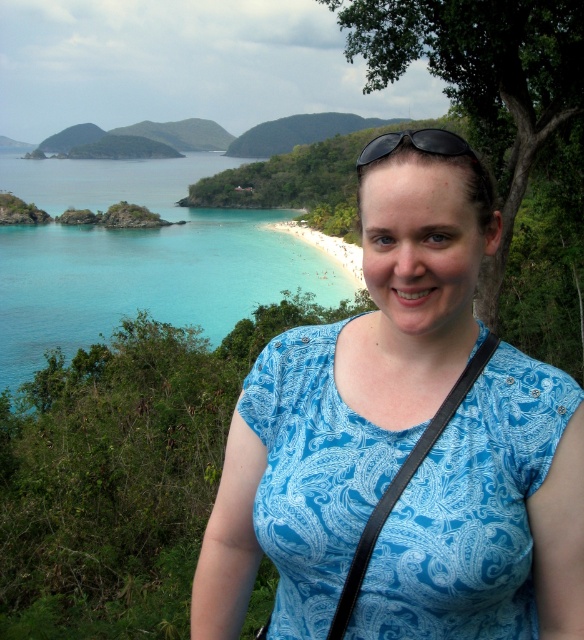
Who is more distant from viewer, (2, 230) or (418, 144)?

The point (2, 230) is more distant.

Who is positioned more to the right, turquoise water at upper left or black plastic sunglasses at upper center?

From the viewer's perspective, black plastic sunglasses at upper center appears more on the right side.

Who is more distant from viewer, (15, 348) or (422, 150)?

Positioned behind is point (15, 348).

Locate an element on the screen. turquoise water at upper left is located at coordinates (140, 257).

In the scene shown: Is blue paisley shirt at center shorter than turquoise water at upper left?

Indeed, blue paisley shirt at center has a lesser height compared to turquoise water at upper left.

The height and width of the screenshot is (640, 584). Describe the element at coordinates (402, 445) in the screenshot. I see `blue paisley shirt at center` at that location.

This screenshot has width=584, height=640. Identify the location of blue paisley shirt at center. (402, 445).

Is blue paisley shirt at center smaller than black plastic sunglasses at upper center?

Correct, blue paisley shirt at center occupies less space than black plastic sunglasses at upper center.

Can you confirm if blue paisley shirt at center is bigger than black plastic sunglasses at upper center?

No, blue paisley shirt at center is not bigger than black plastic sunglasses at upper center.

Who is more forward, (394, 179) or (391, 140)?

Positioned in front is point (394, 179).

You are a GUI agent. You are given a task and a screenshot of the screen. Output one action in this format:
    pyautogui.click(x=<x>, y=<y>)
    Task: Click on the blue paisley shirt at center
    This screenshot has width=584, height=640.
    Given the screenshot: What is the action you would take?
    pyautogui.click(x=402, y=445)